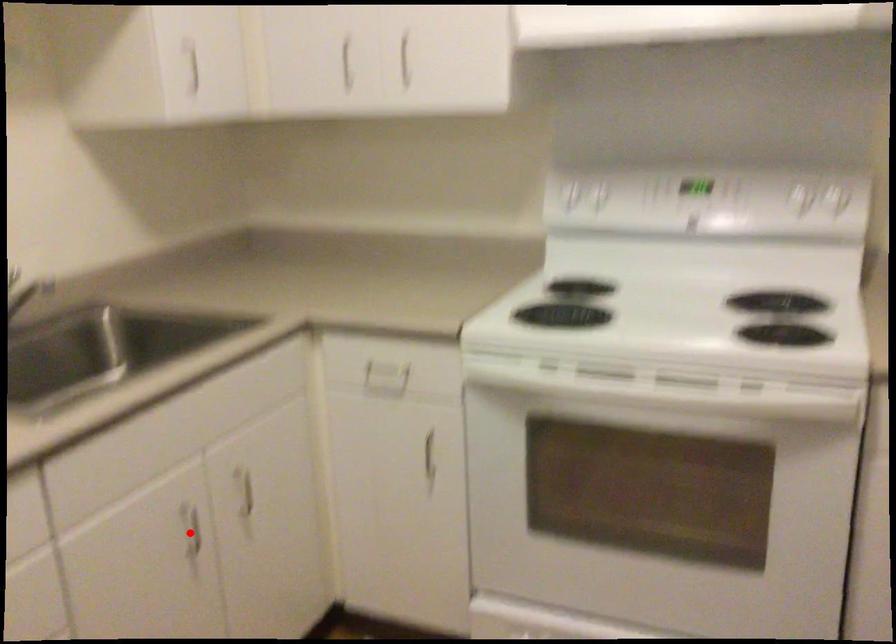
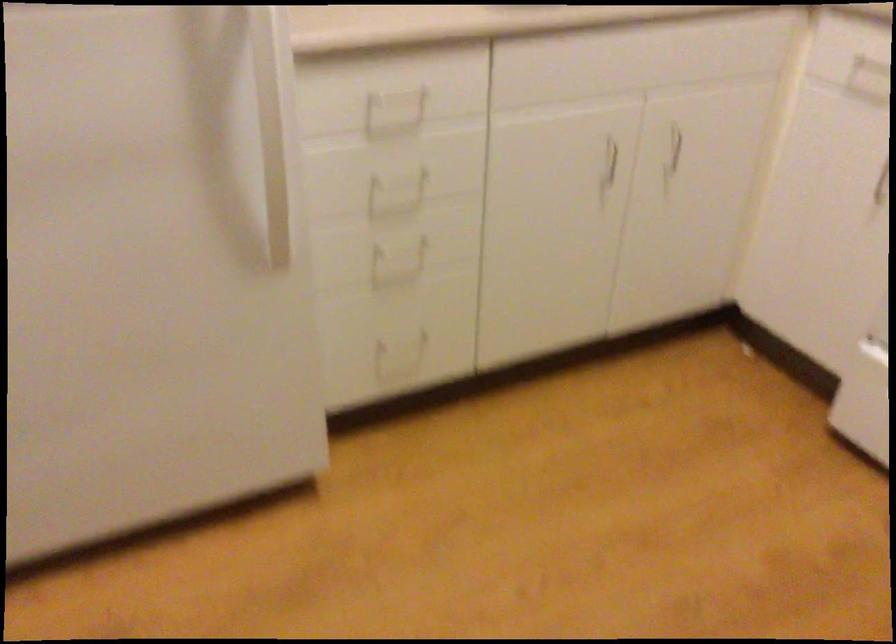
In the second image, find the point that corresponds to the highlighted location in the first image.

(609, 161)